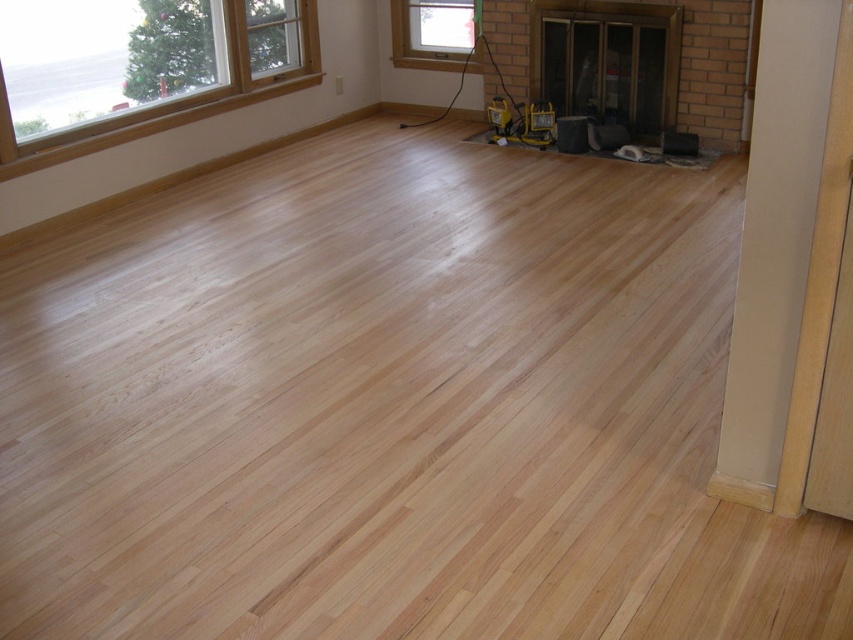
You are a painter standing at the camera position in the room. You need to paint a clear glass window at upper center that is 19.08 feet away. Can you reach it with a 15 foot ladder?

The clear glass window at upper center is 19.08 feet away from the camera, which is further than the 15 foot ladder. Therefore, you cannot reach it with the ladder.

You are standing in the room and want to walk to the center of the natural wood floor at center. Which direction should you walk from your current position at point (364, 396)?

You are already at the center of the natural wood floor at center, as point (364, 396) corresponds to it.

You are a contractor inspecting the newly installed hardwood floor. You notice the clear glass window at upper center and the yellow plastic tool at center. Which object is positioned higher in the room?

The clear glass window at upper center is located above the yellow plastic tool at center, so it is positioned higher in the room.